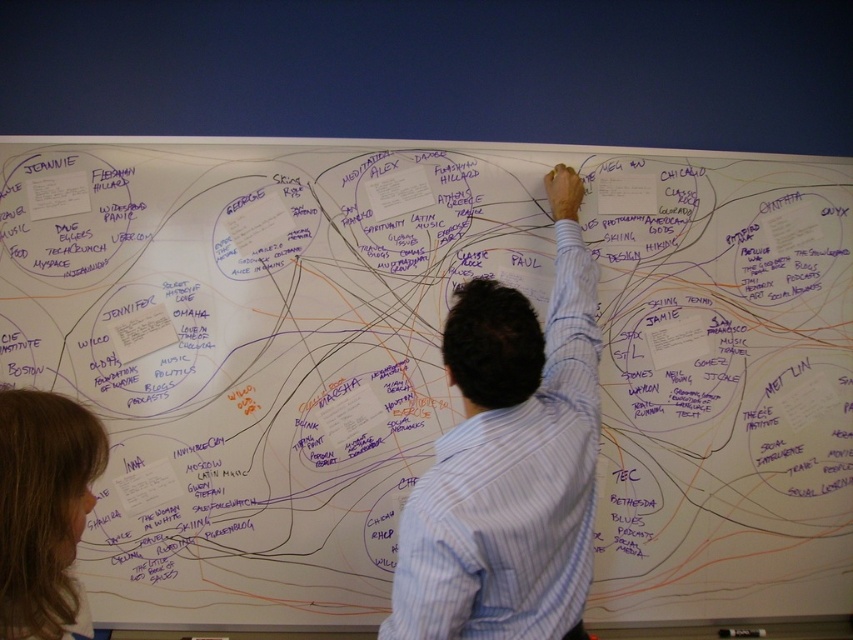
Consider the image. What is the position of the white striped shirt at center in the image?

The white striped shirt at center is located at point 0.722 on the x axis and 0.598 on the y axis.

You are an observer looking at the whiteboard. You notice two elements on the whiteboard labeled as the white striped shirt at center and brown hair at lower left. Which one appears wider?

The white striped shirt at center is wider than the brown hair at lower left.